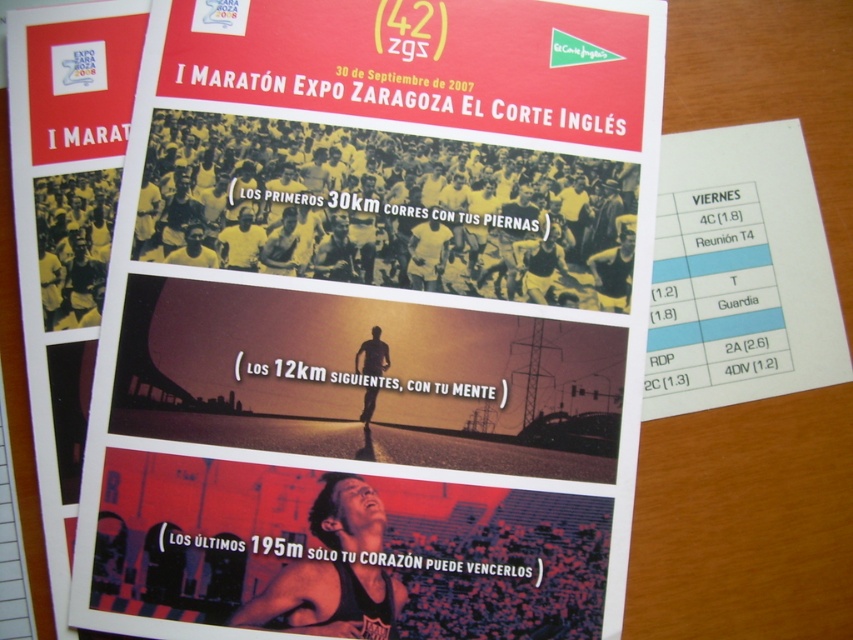
Question: Does matte black runner at lower center appear on the right side of white paper at upper right?

Choices:
 (A) no
 (B) yes

Answer: (A)

Question: Can you confirm if matte black runner at lower center is positioned to the right of white paper at upper right?

Choices:
 (A) yes
 (B) no

Answer: (B)

Question: Can you confirm if matte black runner at lower center is positioned above white paper at upper right?

Choices:
 (A) yes
 (B) no

Answer: (B)

Question: Which object appears farthest from the camera in this image?

Choices:
 (A) white paper at upper right
 (B) matte black runner at lower center

Answer: (A)

Question: Which of the following is the farthest from the observer?

Choices:
 (A) matte black runner at lower center
 (B) white paper at upper right

Answer: (B)